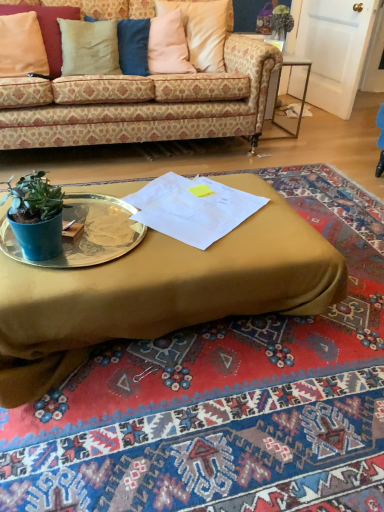
The image size is (384, 512). I want to click on patterned fabric couch at upper center, so click(141, 103).

Describe the element at coordinates (161, 292) in the screenshot. I see `matte gold coffee table at center` at that location.

This screenshot has width=384, height=512. I want to click on metallic silver platter at center, so click(86, 233).

Locate an element on the screen. This screenshot has width=384, height=512. beige fabric pillow at upper left, which is counted as the 1th pillow, starting from the left is located at coordinates (47, 29).

Could you tell me if patterned fabric couch at upper center is facing matte gold coffee table at center?

Yes, patterned fabric couch at upper center is turned towards matte gold coffee table at center.

Is patterned fabric couch at upper center positioned behind matte gold coffee table at center?

Yes.

Looking at this image, is matte gold coffee table at center surrounded by patterned fabric couch at upper center?

No, matte gold coffee table at center is not a part of patterned fabric couch at upper center.

Considering their positions, is beige fabric pillow at upper left, which is the second pillow from right to left, located in front of or behind metallic silver platter at center?

Visually, beige fabric pillow at upper left, which is the second pillow from right to left, is located behind metallic silver platter at center.

Considering the relative sizes of beige fabric pillow at upper left, acting as the second pillow starting from the left, and metallic silver platter at center in the image provided, is beige fabric pillow at upper left, acting as the second pillow starting from the left, taller than metallic silver platter at center?

Correct, beige fabric pillow at upper left, acting as the second pillow starting from the left, is much taller as metallic silver platter at center.

How different are the orientations of beige fabric pillow at upper left, which is the second pillow from right to left, and metallic silver platter at center in degrees?

beige fabric pillow at upper left, which is the second pillow from right to left, and metallic silver platter at center are facing 1.53 degrees away from each other.

Considering the positions of point (76, 25) and point (110, 224), is point (76, 25) closer or farther from the camera than point (110, 224)?

Point (76, 25) is farther from the camera than point (110, 224).

Is matte gold coffee table at center to the left or to the right of beige fabric pillow at upper left, which is counted as the 1th pillow, starting from the left, in the image?

Based on their positions, matte gold coffee table at center is located to the right of beige fabric pillow at upper left, which is counted as the 1th pillow, starting from the left.

How many degrees apart are the facing directions of matte gold coffee table at center and beige fabric pillow at upper left, placed as the third pillow when sorted from right to left?

There is a 180-degree angle between the facing directions of matte gold coffee table at center and beige fabric pillow at upper left, placed as the third pillow when sorted from right to left.

Relative to beige fabric pillow at upper left, which is counted as the 1th pillow, starting from the left, is matte gold coffee table at center in front or behind?

Clearly, matte gold coffee table at center is in front of beige fabric pillow at upper left, which is counted as the 1th pillow, starting from the left.

Looking at their sizes, would you say matte gold coffee table at center is wider or thinner than patterned fabric couch at upper center?

In the image, matte gold coffee table at center appears to be more narrow than patterned fabric couch at upper center.

Which is more to the left, matte gold coffee table at center or patterned fabric couch at upper center?

patterned fabric couch at upper center is more to the left.

Which is behind, point (252, 253) or point (197, 81)?

The point (197, 81) is farther from the camera.

Who is more distant, metallic silver platter at center or metallic mirrored side table at right?

metallic mirrored side table at right.

Consider the image. Between metallic silver platter at center and metallic mirrored side table at right, which one has smaller width?

metallic mirrored side table at right.

Identify the location of platter in front of the metallic mirrored side table at right. The width and height of the screenshot is (384, 512). (86, 233).

Between metallic silver platter at center and metallic mirrored side table at right, which one has smaller size?

metallic silver platter at center.

Between patterned fabric couch at upper center and beige fabric pillow at upper left, acting as the second pillow starting from the left, which one is positioned in front?

Positioned in front is patterned fabric couch at upper center.

Is patterned fabric couch at upper center facing away from beige fabric pillow at upper left, acting as the second pillow starting from the left?

That's right, patterned fabric couch at upper center is facing away from beige fabric pillow at upper left, acting as the second pillow starting from the left.

Is point (154, 106) in front of point (112, 63)?

Yes.

Can you tell me how much patterned fabric couch at upper center and beige fabric pillow at upper left, acting as the second pillow starting from the left, differ in facing direction?

The angular difference between patterned fabric couch at upper center and beige fabric pillow at upper left, acting as the second pillow starting from the left, is 0.000788 degrees.

From their relative heights in the image, would you say beige fabric pillow at upper left, which is the second pillow from right to left, is taller or shorter than beige fabric pillow at upper left, placed as the third pillow when sorted from right to left?

In the image, beige fabric pillow at upper left, which is the second pillow from right to left, appears to be shorter than beige fabric pillow at upper left, placed as the third pillow when sorted from right to left.

What's the angular difference between beige fabric pillow at upper left, acting as the second pillow starting from the left, and beige fabric pillow at upper left, which is counted as the 1th pillow, starting from the left,'s facing directions?

1.75 degrees separate the facing orientations of beige fabric pillow at upper left, acting as the second pillow starting from the left, and beige fabric pillow at upper left, which is counted as the 1th pillow, starting from the left.

Could you tell me if beige fabric pillow at upper left, which is the second pillow from right to left, is turned towards beige fabric pillow at upper left, placed as the third pillow when sorted from right to left?

No, beige fabric pillow at upper left, which is the second pillow from right to left, is not facing towards beige fabric pillow at upper left, placed as the third pillow when sorted from right to left.

Are beige fabric pillow at upper left, which is the second pillow from right to left, and beige fabric pillow at upper left, placed as the third pillow when sorted from right to left, far apart?

beige fabric pillow at upper left, which is the second pillow from right to left, is near beige fabric pillow at upper left, placed as the third pillow when sorted from right to left, not far away.

The height and width of the screenshot is (512, 384). Identify the location of coffee table below the patterned fabric couch at upper center (from a real-world perspective). (161, 292).

This screenshot has height=512, width=384. I want to click on the 2nd pillow behind the metallic silver platter at center, counting from the anchor's position, so click(x=89, y=47).

Based on their spatial positions, is beige fabric pillow at upper left, which is the second pillow from right to left, or metallic mirrored side table at right further from beige fabric pillow at upper left, which is counted as the 1th pillow, starting from the left?

The object further to beige fabric pillow at upper left, which is counted as the 1th pillow, starting from the left, is metallic mirrored side table at right.

From the image, which object appears to be nearer to metallic silver platter at center, metallic mirrored side table at right or beige fabric pillow at upper left, which is counted as the 1th pillow, starting from the left?

Based on the image, beige fabric pillow at upper left, which is counted as the 1th pillow, starting from the left, appears to be nearer to metallic silver platter at center.

When comparing their distances from patterned fabric couch at upper center, does metallic silver platter at center or pink fabric pillow at upper center, which is the 3th pillow from left to right, seem closer?

pink fabric pillow at upper center, which is the 3th pillow from left to right, lies closer to patterned fabric couch at upper center than the other object.

Looking at the image, which one is located closer to metallic mirrored side table at right, beige fabric pillow at upper left, which is counted as the 1th pillow, starting from the left, or pink fabric pillow at upper center, positioned as the first pillow in right-to-left order?

pink fabric pillow at upper center, positioned as the first pillow in right-to-left order, is positioned closer to the anchor metallic mirrored side table at right.

When comparing their distances from metallic mirrored side table at right, does metallic silver platter at center or beige fabric pillow at upper left, acting as the second pillow starting from the left, seem further?

metallic silver platter at center.

Considering their positions, is beige fabric pillow at upper left, acting as the second pillow starting from the left, positioned further to pink fabric pillow at upper center, which is the 3th pillow from left to right, than patterned fabric couch at upper center?

beige fabric pillow at upper left, acting as the second pillow starting from the left, lies further to pink fabric pillow at upper center, which is the 3th pillow from left to right, than the other object.

When comparing their distances from beige fabric pillow at upper left, which is the second pillow from right to left, does beige fabric pillow at upper left, which is counted as the 1th pillow, starting from the left, or matte gold coffee table at center seem further?

matte gold coffee table at center.

Looking at this image, considering their positions, is metallic mirrored side table at right positioned closer to metallic silver platter at center than pink fabric pillow at upper center, positioned as the first pillow in right-to-left order?

Among the two, pink fabric pillow at upper center, positioned as the first pillow in right-to-left order, is located nearer to metallic silver platter at center.

Identify the location of studio couch between beige fabric pillow at upper left, which is the second pillow from right to left, and metallic mirrored side table at right. tap(141, 103).

Locate an element on the screen. pillow between patterned fabric couch at upper center and beige fabric pillow at upper left, acting as the second pillow starting from the left, in the front-back direction is located at coordinates (47, 29).

At what (x,y) coordinates should I click in order to perform the action: click on pillow between beige fabric pillow at upper left, placed as the third pillow when sorted from right to left, and pink fabric pillow at upper center, which is the 3th pillow from left to right, from left to right. Please return your answer as a coordinate pair (x, y). Looking at the image, I should click on (89, 47).

Image resolution: width=384 pixels, height=512 pixels. I want to click on studio couch positioned between metallic silver platter at center and metallic mirrored side table at right from near to far, so click(141, 103).